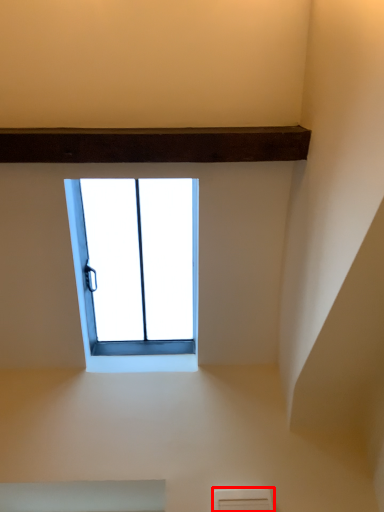
Question: In this image, where is air conditioning (annotated by the red box) located relative to window?

Choices:
 (A) right
 (B) left

Answer: (A)